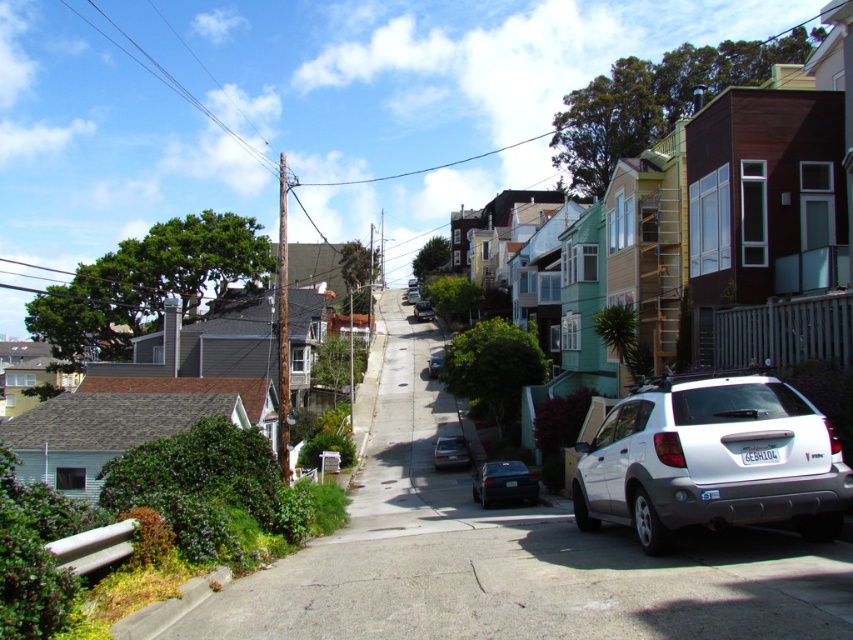
You are a delivery driver approaching the street and need to park your vehicle. You see the white matte suv at lower right and the metallic silver sedan at center. Which vehicle is closer to you as you drive along the street?

The white matte suv at lower right is closer to you because it is positioned in front of the metallic silver sedan at center, meaning it is nearer to your current position along the street.

You are a delivery driver trying to navigate through the residential street. You need to pass by the white matte suv at lower right and the matte black sedan at center. Which vehicle should you move around first to stay on the correct path?

The white matte suv at lower right is in front of the matte black sedan at center, so you should move around the white matte suv at lower right first to stay on the correct path.